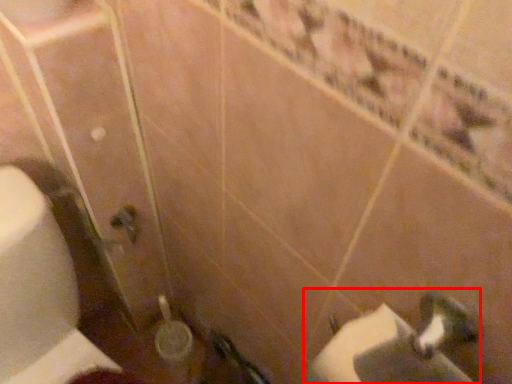
Question: Considering the relative positions of sink (annotated by the red box) and toilet paper in the image provided, where is sink (annotated by the red box) located with respect to the staircase?

Choices:
 (A) right
 (B) left

Answer: (A)